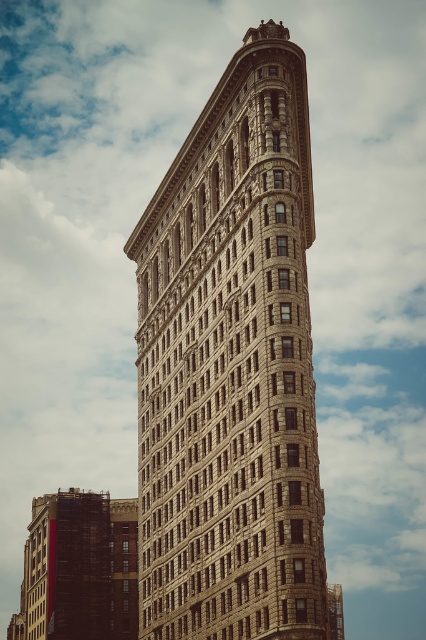
Question: Does brown stone building at center lie behind gold textured clock at center?

Choices:
 (A) yes
 (B) no

Answer: (B)

Question: Where is brown stone building at center located in relation to gold textured clock at center in the image?

Choices:
 (A) below
 (B) above

Answer: (A)

Question: Is the position of brown stone building at center less distant than that of gold textured clock at center?

Choices:
 (A) yes
 (B) no

Answer: (A)

Question: Which object is the closest to the brown stone building at center?

Choices:
 (A) gold textured clock at center
 (B) brown brick building at lower left

Answer: (A)

Question: Which object appears farthest from the camera in this image?

Choices:
 (A) gold textured clock at center
 (B) brown stone building at center
 (C) brown brick building at lower left

Answer: (C)

Question: Which point is farther from the camera taking this photo?

Choices:
 (A) (31, 592)
 (B) (319, 556)

Answer: (A)